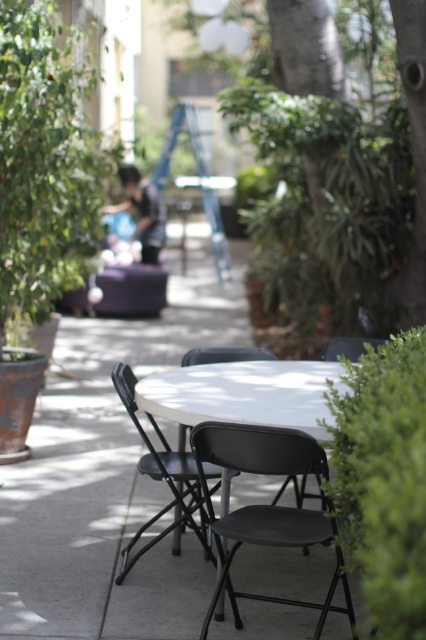
You are standing at the origin point of the image coordinate system. The image coordinate system has the origin at the bottom left corner. You want to place a new table at coordinate point 0.7, 0.6. Is there enough space to place the table there without overlapping with the black plastic folding chair at center?

The black plastic folding chair at center is located at coordinate point (267, 506). The new table is at (255, 448). The distance between them is sqrt of squared differences in x and y coordinates. The distance is sqrt of 0.091 squared plus 0.029 squared, which is approximately 0.095. If the table has a radius or half of its width plus the chair half width is less than 0.095, then yes. But since we donot know the size of the table and chair, it is hard to tell. However, according to the scene description, a

You are standing at the center of the patio and want to place a decorative pot at the exact center of the white matte table at center. Given that the patio is represented on a coordinate system where the bottom left corner is the origin, can you determine the coordinates where you should place the decorative pot?

The coordinates for the white matte table at center are given as point (x=244, y=394), so you should place the decorative pot at those coordinates to center it on the white matte table at center.

You are planning to place a small potted plant between the black plastic folding chair at center and the white matte table at center. Based on their positions, which side of the table should you place the plant to keep it between them?

The black plastic folding chair at center is positioned on the right side of white matte table at center, so you should place the plant on the right side of the white matte table at center to keep it between them.